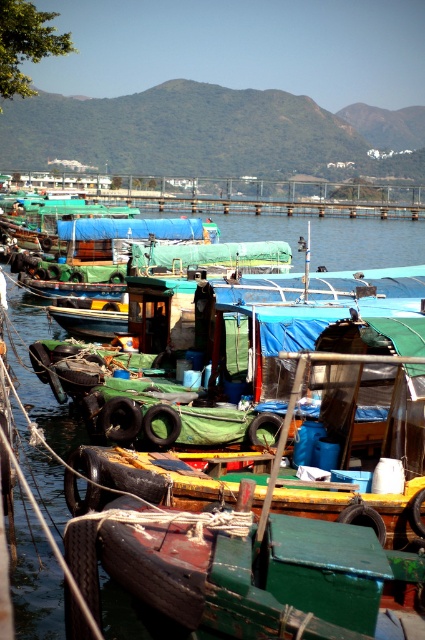
Question: Is transparent plastic water at center positioned at the back of green canvas boat at center?

Choices:
 (A) no
 (B) yes

Answer: (A)

Question: Does transparent plastic water at center have a smaller size compared to green canvas boat at center?

Choices:
 (A) no
 (B) yes

Answer: (A)

Question: Is transparent plastic water at center smaller than green canvas boat at center?

Choices:
 (A) no
 (B) yes

Answer: (A)

Question: Which object appears farthest from the camera in this image?

Choices:
 (A) transparent plastic water at center
 (B) green canvas boat at center

Answer: (B)